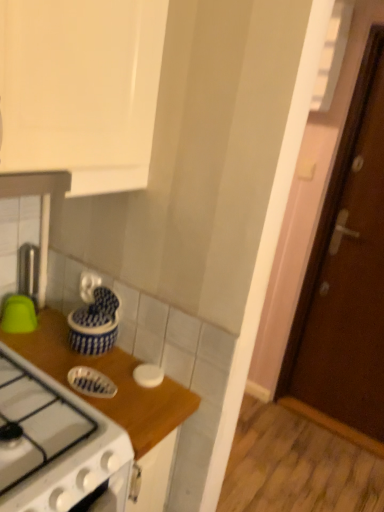
Question: Does blue glossy dish at center, the 3th kitchen appliance from the left, appear on the right side of white matte lid at center, the fourth kitchen appliance viewed from the left?

Choices:
 (A) no
 (B) yes

Answer: (A)

Question: Is blue glossy dish at center, arranged as the 2th kitchen appliance when viewed from the right, to the left of white matte lid at center, which is counted as the first kitchen appliance, starting from the right, from the viewer's perspective?

Choices:
 (A) yes
 (B) no

Answer: (A)

Question: Is blue glossy dish at center, arranged as the 2th kitchen appliance when viewed from the right, bigger than white matte lid at center, the fourth kitchen appliance viewed from the left?

Choices:
 (A) no
 (B) yes

Answer: (B)

Question: Does blue glossy dish at center, arranged as the 2th kitchen appliance when viewed from the right, have a greater width compared to white matte lid at center, the fourth kitchen appliance viewed from the left?

Choices:
 (A) no
 (B) yes

Answer: (B)

Question: Is blue glossy dish at center, arranged as the 2th kitchen appliance when viewed from the right, closer to camera compared to white matte lid at center, the fourth kitchen appliance viewed from the left?

Choices:
 (A) yes
 (B) no

Answer: (A)

Question: Are blue glossy dish at center, arranged as the 2th kitchen appliance when viewed from the right, and white matte lid at center, which is counted as the first kitchen appliance, starting from the right, beside each other?

Choices:
 (A) no
 (B) yes

Answer: (A)

Question: From the image's perspective, is white matte lid at center, which is counted as the first kitchen appliance, starting from the right, on top of blue glossy dish at center, arranged as the 2th kitchen appliance when viewed from the right?

Choices:
 (A) yes
 (B) no

Answer: (B)

Question: Can you confirm if white matte lid at center, which is counted as the first kitchen appliance, starting from the right, is smaller than blue glossy dish at center, arranged as the 2th kitchen appliance when viewed from the right?

Choices:
 (A) no
 (B) yes

Answer: (B)

Question: Is white matte lid at center, the fourth kitchen appliance viewed from the left, positioned in front of blue glossy dish at center, the 3th kitchen appliance from the left?

Choices:
 (A) no
 (B) yes

Answer: (A)

Question: From the image's perspective, would you say white matte lid at center, the fourth kitchen appliance viewed from the left, is shown under blue glossy dish at center, arranged as the 2th kitchen appliance when viewed from the right?

Choices:
 (A) yes
 (B) no

Answer: (A)

Question: Can you confirm if white matte lid at center, which is counted as the first kitchen appliance, starting from the right, is taller than blue glossy dish at center, arranged as the 2th kitchen appliance when viewed from the right?

Choices:
 (A) no
 (B) yes

Answer: (A)

Question: Is white matte lid at center, which is counted as the first kitchen appliance, starting from the right, aimed at blue glossy dish at center, the 3th kitchen appliance from the left?

Choices:
 (A) yes
 (B) no

Answer: (B)

Question: Is blue glossy dish at center, the 3th kitchen appliance from the left, outside of brown wooden door at right?

Choices:
 (A) no
 (B) yes

Answer: (B)